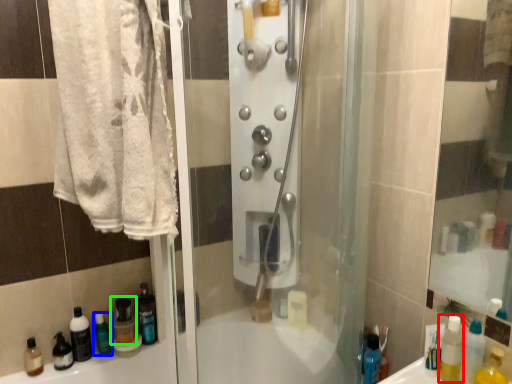
Question: Which object is the farthest from mouthwash (highlighted by a red box)? Choose among these: cleaning product (highlighted by a blue box) or bottle (highlighted by a green box).

Choices:
 (A) cleaning product
 (B) bottle

Answer: (A)